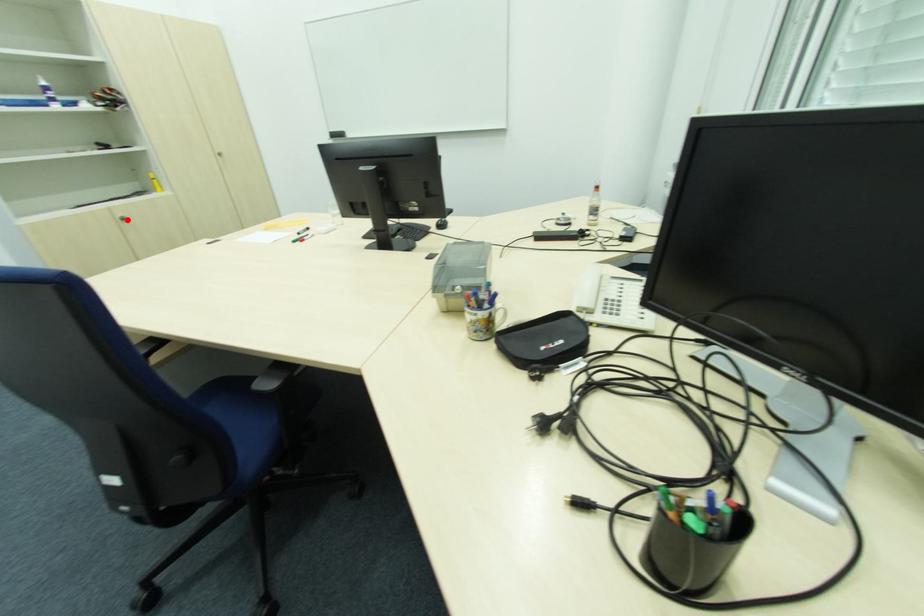
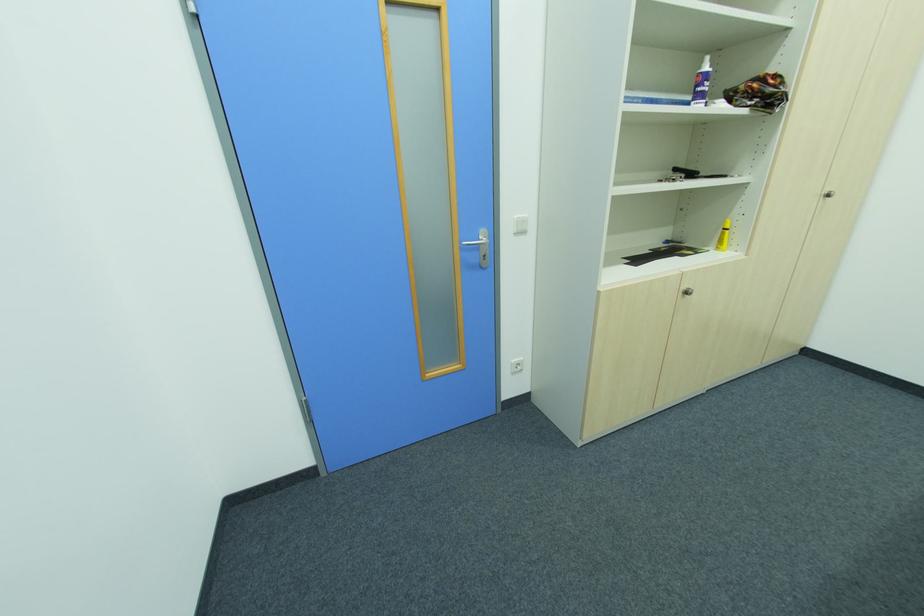
Find the pixel in the second image that matches the highlighted location in the first image.

(689, 294)